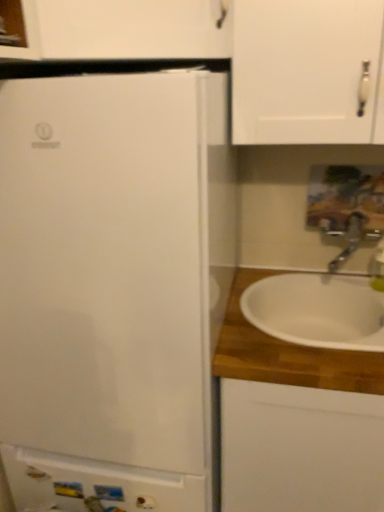
Question: Is white glossy cabinet at lower left, placed as the 2th cabinetry when sorted from right to left, positioned in front of satin nickel faucet at right?

Choices:
 (A) yes
 (B) no

Answer: (A)

Question: Does white glossy cabinet at lower left, placed as the 2th cabinetry when sorted from right to left, have a larger size compared to satin nickel faucet at right?

Choices:
 (A) no
 (B) yes

Answer: (A)

Question: Considering the relative sizes of white glossy cabinet at lower left, placed as the 2th cabinetry when sorted from right to left, and satin nickel faucet at right in the image provided, is white glossy cabinet at lower left, placed as the 2th cabinetry when sorted from right to left, taller than satin nickel faucet at right?

Choices:
 (A) no
 (B) yes

Answer: (B)

Question: From the image's perspective, is white glossy cabinet at lower left, the first cabinetry from the left, under satin nickel faucet at right?

Choices:
 (A) yes
 (B) no

Answer: (A)

Question: Is white glossy cabinet at lower left, the first cabinetry from the left, to the right of satin nickel faucet at right from the viewer's perspective?

Choices:
 (A) no
 (B) yes

Answer: (A)

Question: Considering the relative positions of white glossy cabinet at lower left, placed as the 2th cabinetry when sorted from right to left, and satin nickel faucet at right in the image provided, is white glossy cabinet at lower left, placed as the 2th cabinetry when sorted from right to left, to the left of satin nickel faucet at right from the viewer's perspective?

Choices:
 (A) yes
 (B) no

Answer: (A)

Question: Considering the relative sizes of white glossy cabinet at lower left, the first cabinetry from the left, and white ceramic sink at right in the image provided, is white glossy cabinet at lower left, the first cabinetry from the left, shorter than white ceramic sink at right?

Choices:
 (A) no
 (B) yes

Answer: (A)

Question: From the image's perspective, does white glossy cabinet at lower left, placed as the 2th cabinetry when sorted from right to left, appear higher than white ceramic sink at right?

Choices:
 (A) yes
 (B) no

Answer: (B)

Question: From the image's perspective, does white glossy cabinet at lower left, placed as the 2th cabinetry when sorted from right to left, appear lower than white ceramic sink at right?

Choices:
 (A) no
 (B) yes

Answer: (B)

Question: Considering the relative positions of white glossy cabinet at lower left, the first cabinetry from the left, and white ceramic sink at right in the image provided, is white glossy cabinet at lower left, the first cabinetry from the left, to the right of white ceramic sink at right from the viewer's perspective?

Choices:
 (A) yes
 (B) no

Answer: (B)

Question: Is white glossy cabinet at lower left, the first cabinetry from the left, positioned far away from white ceramic sink at right?

Choices:
 (A) no
 (B) yes

Answer: (A)

Question: From a real-world perspective, is white glossy cabinet at lower left, the first cabinetry from the left, positioned over white ceramic sink at right based on gravity?

Choices:
 (A) no
 (B) yes

Answer: (A)

Question: From a real-world perspective, is white wood cabinet at right, positioned as the 1th cabinetry in right-to-left order, positioned over satin nickel faucet at right based on gravity?

Choices:
 (A) no
 (B) yes

Answer: (A)